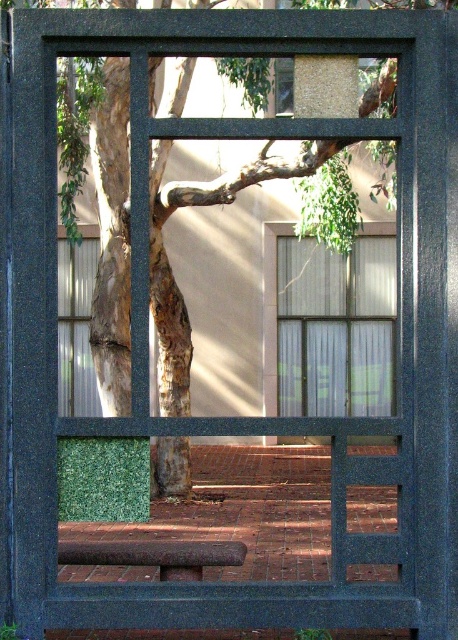
You are sitting on the rustic wood bench at lower center and looking up. Can you see the clear glass window at center through your line of sight?

Yes, because the clear glass window at center is positioned over the rustic wood bench at lower center, so when sitting on the bench, the window would be directly above and visible in your line of sight.

You are standing in a room with a black window frame. You need to place a small potted plant exactly at the center of the clear glass window at center. According to the coordinates provided, where should you place the plant?

The clear glass window at center is located at point (333, 324), so you should place the small potted plant at those coordinates to center it.